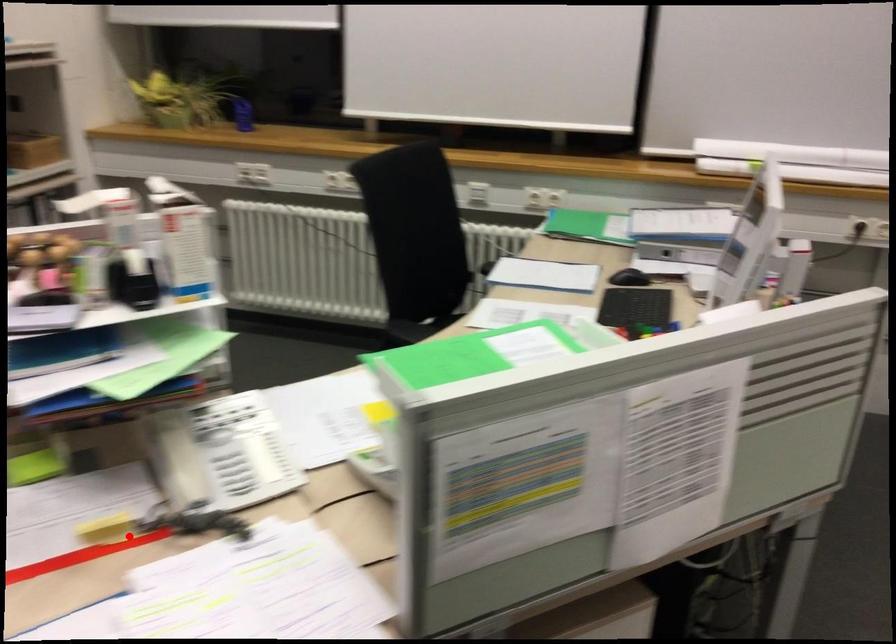
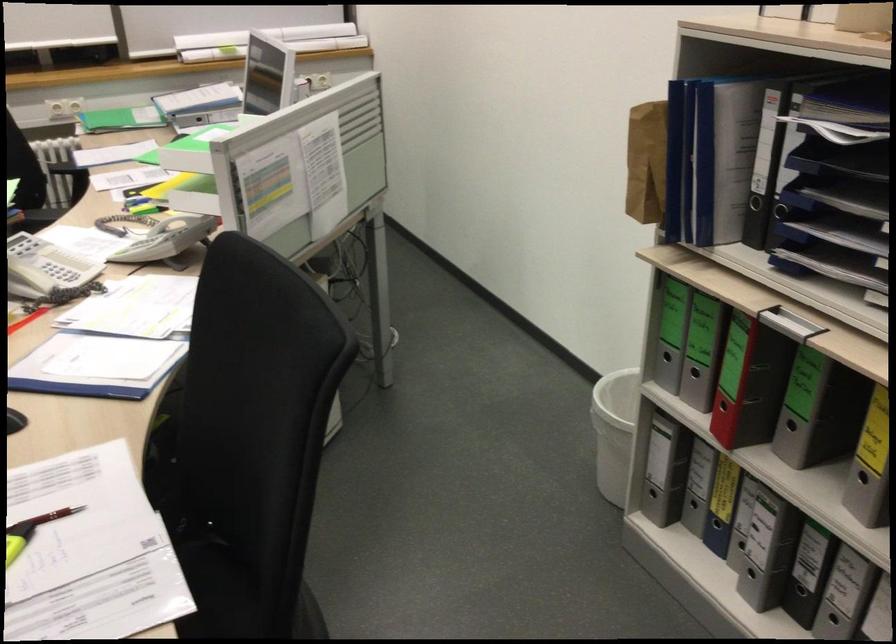
Locate, in the second image, the point that corresponds to the highlighted location in the first image.

(26, 319)